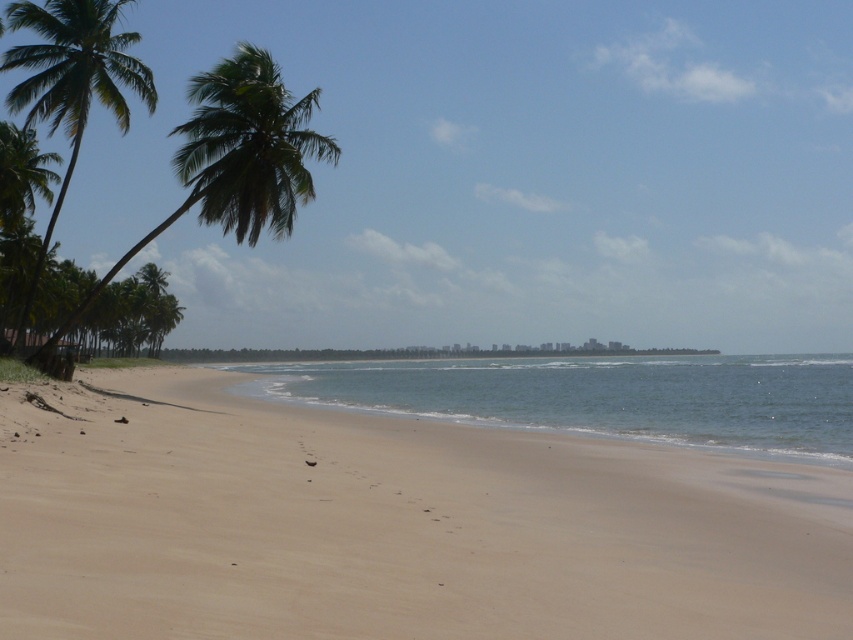
Is blue water at center wider than green leafy palm tree at left?

Yes, blue water at center is wider than green leafy palm tree at left.

Between blue water at center and green leafy palm tree at left, which one has less height?

blue water at center

Does point (532, 419) come farther from viewer compared to point (119, 97)?

That is False.

Locate an element on the screen. This screenshot has width=853, height=640. blue water at center is located at coordinates (606, 396).

Can you confirm if beige sand at lower center is thinner than blue water at center?

Indeed, beige sand at lower center has a lesser width compared to blue water at center.

Which is behind, point (439, 426) or point (322, 378)?

Point (322, 378)

Identify the location of beige sand at lower center. The width and height of the screenshot is (853, 640). (393, 525).

Does beige sand at lower center have a smaller size compared to green leafy palm tree at left?

Correct, beige sand at lower center occupies less space than green leafy palm tree at left.

Does point (469, 625) lie behind point (125, 74)?

No, (469, 625) is closer to viewer.

I want to click on beige sand at lower center, so click(393, 525).